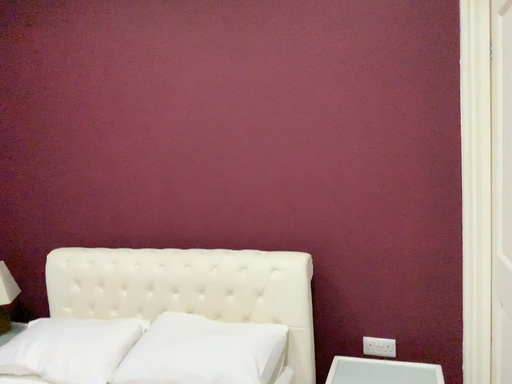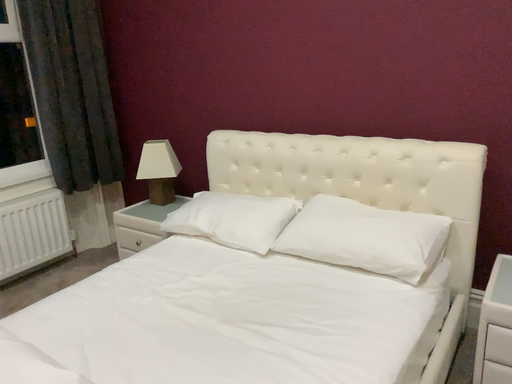
Question: How did the camera likely rotate when shooting the video?

Choices:
 (A) rotated left
 (B) rotated right

Answer: (A)